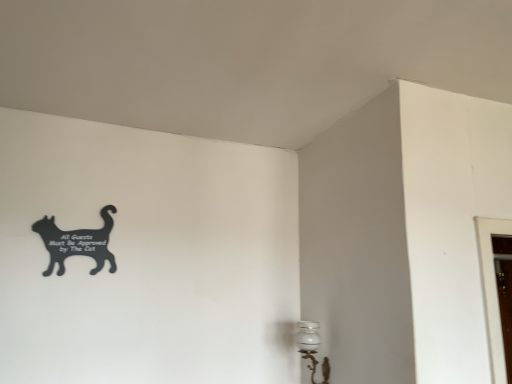
Question: Would you say white glossy lamp at lower right contains black matte sign at upper left?

Choices:
 (A) yes
 (B) no

Answer: (B)

Question: Can you confirm if white glossy lamp at lower right is taller than black matte sign at upper left?

Choices:
 (A) yes
 (B) no

Answer: (A)

Question: Can you confirm if white glossy lamp at lower right is wider than black matte sign at upper left?

Choices:
 (A) yes
 (B) no

Answer: (A)

Question: From the image's perspective, is white glossy lamp at lower right located beneath black matte sign at upper left?

Choices:
 (A) yes
 (B) no

Answer: (A)

Question: Is white glossy lamp at lower right positioned behind black matte sign at upper left?

Choices:
 (A) no
 (B) yes

Answer: (A)

Question: Considering the relative positions of white glossy lamp at lower right and black matte sign at upper left in the image provided, is white glossy lamp at lower right to the left of black matte sign at upper left from the viewer's perspective?

Choices:
 (A) no
 (B) yes

Answer: (A)

Question: Is black matte sign at upper left smaller than white glossy lamp at lower right?

Choices:
 (A) yes
 (B) no

Answer: (A)

Question: Is black matte sign at upper left wider than white glossy lamp at lower right?

Choices:
 (A) no
 (B) yes

Answer: (A)

Question: Considering the relative sizes of black matte sign at upper left and white glossy lamp at lower right in the image provided, is black matte sign at upper left shorter than white glossy lamp at lower right?

Choices:
 (A) no
 (B) yes

Answer: (B)

Question: Is white glossy lamp at lower right completely or partially inside black matte sign at upper left?

Choices:
 (A) no
 (B) yes

Answer: (A)

Question: Is black matte sign at upper left next to white glossy lamp at lower right and touching it?

Choices:
 (A) yes
 (B) no

Answer: (B)

Question: Is black matte sign at upper left bigger than white glossy lamp at lower right?

Choices:
 (A) yes
 (B) no

Answer: (B)

Question: In terms of width, does black matte sign at upper left look wider or thinner when compared to white glossy lamp at lower right?

Choices:
 (A) wide
 (B) thin

Answer: (B)